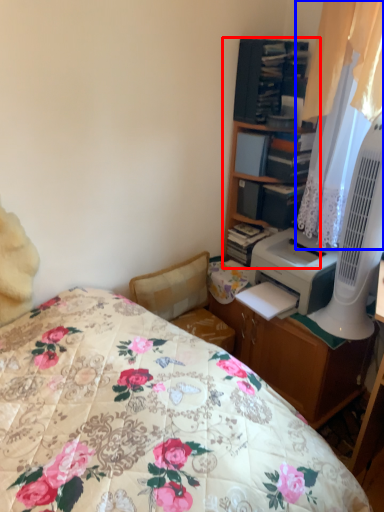
Question: Which object appears farthest to the camera in this image, cabinetry (highlighted by a red box) or curtain (highlighted by a blue box)?

Choices:
 (A) cabinetry
 (B) curtain

Answer: (A)